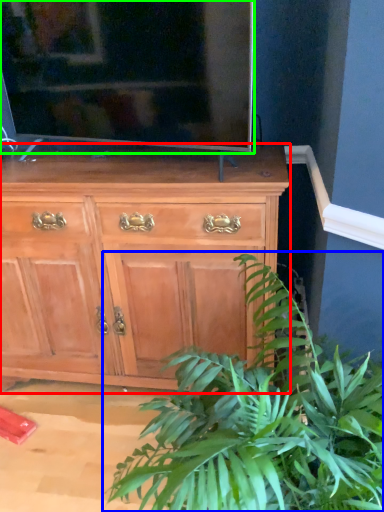
Question: Which is nearer to the chest of drawers (highlighted by a red box)? houseplant (highlighted by a blue box) or television (highlighted by a green box).

Choices:
 (A) houseplant
 (B) television

Answer: (B)